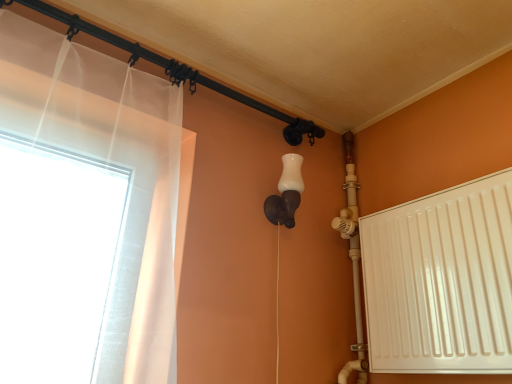
Find the location of a particular element. The width and height of the screenshot is (512, 384). black metal pipe at upper left is located at coordinates (175, 70).

Where is `white matte wall sconce at center`? white matte wall sconce at center is located at coordinates (286, 193).

Find the location of a particular element. black metal pipe at upper left is located at coordinates (175, 70).

Is white matte wall sconce at center oriented towards white matte radiator at right?

No, white matte wall sconce at center is not turned towards white matte radiator at right.

Considering the sizes of objects white matte wall sconce at center and white matte radiator at right in the image provided, who is smaller, white matte wall sconce at center or white matte radiator at right?

white matte wall sconce at center is smaller.

Between point (293, 220) and point (410, 314), which one is positioned in front?

The point (410, 314) is closer to the camera.

Considering the sizes of black metal pipe at upper left and white matte radiator at right in the image, is black metal pipe at upper left wider or thinner than white matte radiator at right?

black metal pipe at upper left is thinner than white matte radiator at right.

How much distance is there between black metal pipe at upper left and white matte radiator at right?

27.46 inches.

Considering the relative sizes of black metal pipe at upper left and white matte radiator at right in the image provided, is black metal pipe at upper left taller than white matte radiator at right?

Incorrect, the height of black metal pipe at upper left is not larger of that of white matte radiator at right.

Where is `pipe lying above the white matte radiator at right (from the image's perspective)`? pipe lying above the white matte radiator at right (from the image's perspective) is located at coordinates [x=175, y=70].

From the image's perspective, which one is positioned lower, black metal pipe at upper left or white matte wall sconce at center?

white matte wall sconce at center is shown below in the image.

How different are the orientations of black metal pipe at upper left and white matte wall sconce at center in degrees?

The angle between the facing direction of black metal pipe at upper left and the facing direction of white matte wall sconce at center is 0.514 degrees.

Is the position of black metal pipe at upper left more distant than that of white matte wall sconce at center?

No, black metal pipe at upper left is in front of white matte wall sconce at center.

Is black metal pipe at upper left to the left of white matte wall sconce at center from the viewer's perspective?

Yes, black metal pipe at upper left is to the left of white matte wall sconce at center.

In the scene shown: Is white matte radiator at right located outside white matte wall sconce at center?

Yes, white matte radiator at right is not within white matte wall sconce at center.

In the scene shown: Based on their positions, is white matte radiator at right located to the left or right of white matte wall sconce at center?

white matte radiator at right is to the right of white matte wall sconce at center.

Does white matte radiator at right touch white matte wall sconce at center?

white matte radiator at right and white matte wall sconce at center are not in contact.

Is white matte radiator at right not close to black metal pipe at upper left?

No.

Which object is closer to the camera taking this photo, white matte radiator at right or black metal pipe at upper left?

white matte radiator at right is more forward.

Which of these two, white matte radiator at right or black metal pipe at upper left, stands taller?

Standing taller between the two is white matte radiator at right.

You are a GUI agent. You are given a task and a screenshot of the screen. Output one action in this format:
    pyautogui.click(x=<x>, y=<y>)
    Task: Click on the radiator that appears below the black metal pipe at upper left (from a real-world perspective)
    The width and height of the screenshot is (512, 384).
    Given the screenshot: What is the action you would take?
    pyautogui.click(x=441, y=281)

From the picture: Is white matte wall sconce at center aimed at black metal pipe at upper left?

No, white matte wall sconce at center is not oriented towards black metal pipe at upper left.

In the scene shown: Which of these two, white matte wall sconce at center or black metal pipe at upper left, is wider?

white matte wall sconce at center.

Considering the positions of objects white matte wall sconce at center and black metal pipe at upper left in the image provided, who is behind, white matte wall sconce at center or black metal pipe at upper left?

white matte wall sconce at center is behind.

Where is `light fixture located underneath the black metal pipe at upper left (from a real-world perspective)`? light fixture located underneath the black metal pipe at upper left (from a real-world perspective) is located at coordinates (286, 193).

Where is `light fixture behind the white matte radiator at right`? The image size is (512, 384). light fixture behind the white matte radiator at right is located at coordinates pyautogui.click(x=286, y=193).

At what (x,y) coordinates should I click in order to perform the action: click on radiator on the right of black metal pipe at upper left. Please return your answer as a coordinate pair (x, y). Looking at the image, I should click on (441, 281).

Which object lies further to the anchor point white matte wall sconce at center, white matte radiator at right or black metal pipe at upper left?

The object further to white matte wall sconce at center is white matte radiator at right.

When comparing their distances from black metal pipe at upper left, does white matte wall sconce at center or white matte radiator at right seem further?

Among the two, white matte radiator at right is located further to black metal pipe at upper left.

When comparing their distances from white matte radiator at right, does black metal pipe at upper left or white matte wall sconce at center seem further?

black metal pipe at upper left is positioned further to the anchor white matte radiator at right.

Considering their positions, is white matte radiator at right positioned further to black metal pipe at upper left than white matte wall sconce at center?

white matte radiator at right is further to black metal pipe at upper left.

Based on their spatial positions, is black metal pipe at upper left or white matte radiator at right closer to white matte wall sconce at center?

black metal pipe at upper left.

Which object lies further to the anchor point white matte radiator at right, white matte wall sconce at center or black metal pipe at upper left?

black metal pipe at upper left lies further to white matte radiator at right than the other object.

The image size is (512, 384). Identify the location of light fixture situated between black metal pipe at upper left and white matte radiator at right from left to right. (286, 193).